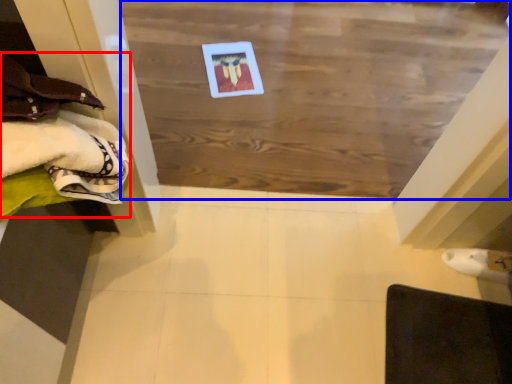
Question: Which point is further to the camera, clothing (highlighted by a red box) or plywood (highlighted by a blue box)?

Choices:
 (A) clothing
 (B) plywood

Answer: (B)